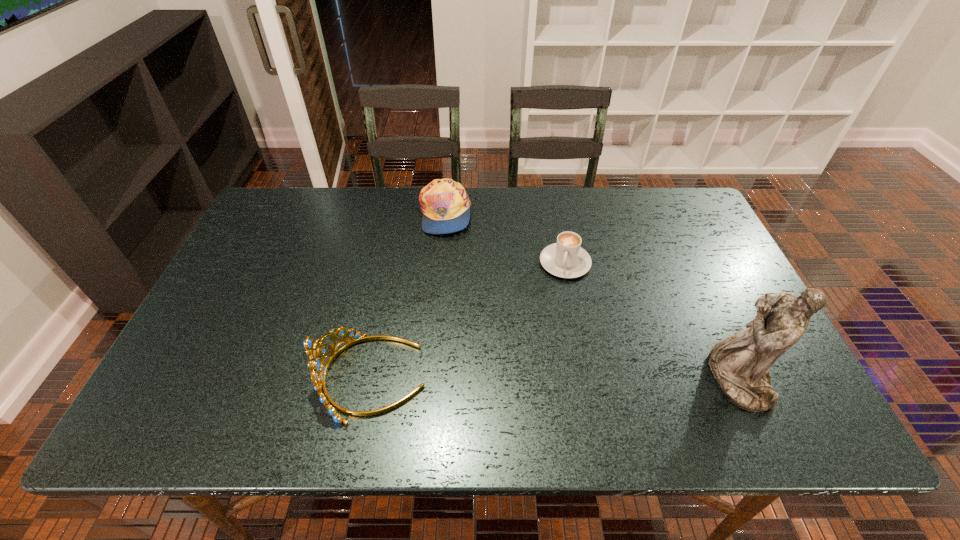
You are a GUI agent. You are given a task and a screenshot of the screen. Output one action in this format:
    pyautogui.click(x=<x>, y=<y>)
    Task: Click on the vacant space on the desktop that is between the second tallest object and the tallest object and is positioned to the right of the second object from right to left
    Image resolution: width=960 pixels, height=540 pixels.
    Given the screenshot: What is the action you would take?
    pyautogui.click(x=535, y=378)

The image size is (960, 540). I want to click on vacant space on the desktop that is between the tiara and the tallest object and is positioned on the bill of the cap, so click(591, 378).